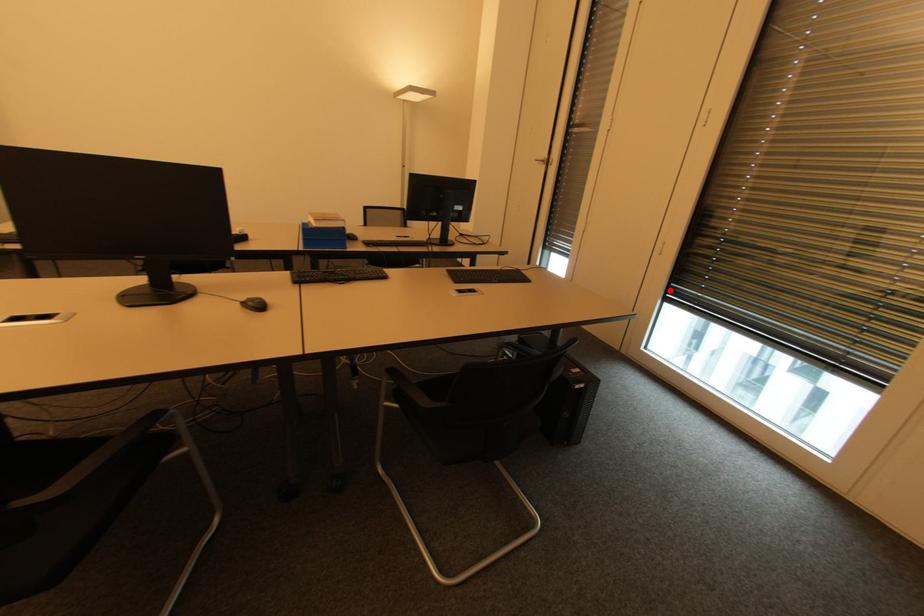
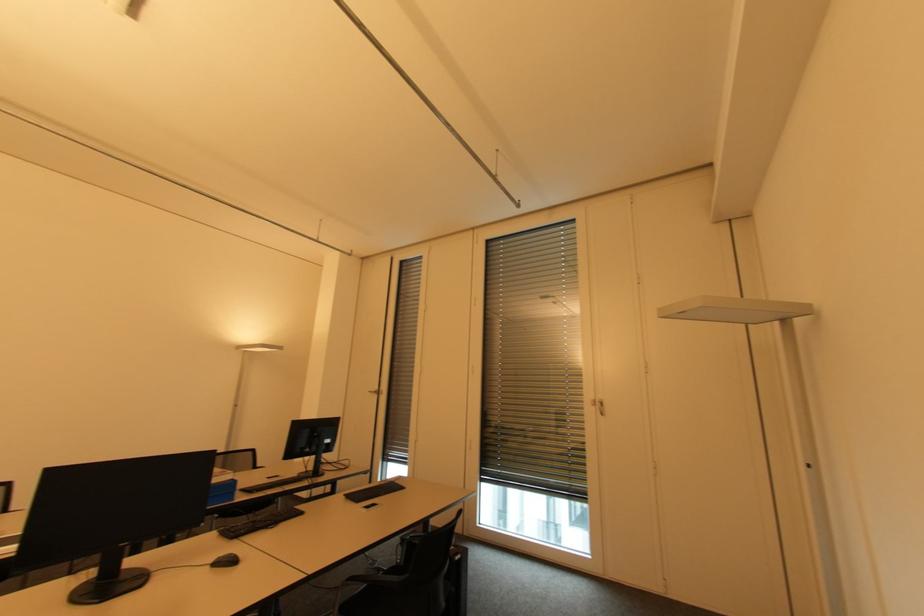
Question: I am providing you with two images of the same scene from different viewpoints. A red point is shown in image1. For the corresponding object point in image2, is it positioned nearer or farther from the camera?

Choices:
 (A) Nearer
 (B) Farther

Answer: (A)